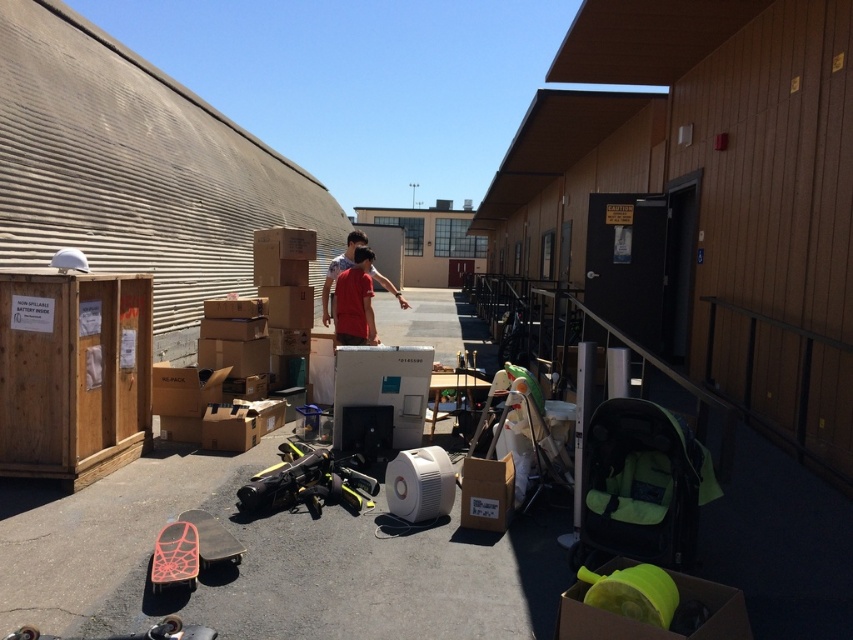
Does brown cardboard box at center have a lesser width compared to matte red shirt at center?

Yes, brown cardboard box at center is thinner than matte red shirt at center.

Does brown cardboard box at center have a greater width compared to matte red shirt at center?

In fact, brown cardboard box at center might be narrower than matte red shirt at center.

Where is `brown cardboard box at center`? Image resolution: width=853 pixels, height=640 pixels. brown cardboard box at center is located at coordinates click(x=486, y=493).

Where is `brown cardboard box at center`? brown cardboard box at center is located at coordinates (486, 493).

What do you see at coordinates (648, 625) in the screenshot?
I see `matte green plastic bucket at lower right` at bounding box center [648, 625].

The width and height of the screenshot is (853, 640). In order to click on matte green plastic bucket at lower right in this screenshot , I will do `click(648, 625)`.

Is matte green plastic bucket at lower right to the right of brown cardboard box at center from the viewer's perspective?

Yes, matte green plastic bucket at lower right is to the right of brown cardboard box at center.

Can you confirm if matte green plastic bucket at lower right is positioned below brown cardboard box at center?

Indeed, matte green plastic bucket at lower right is positioned under brown cardboard box at center.

Find the location of `matte green plastic bucket at lower right`. matte green plastic bucket at lower right is located at coordinates (648, 625).